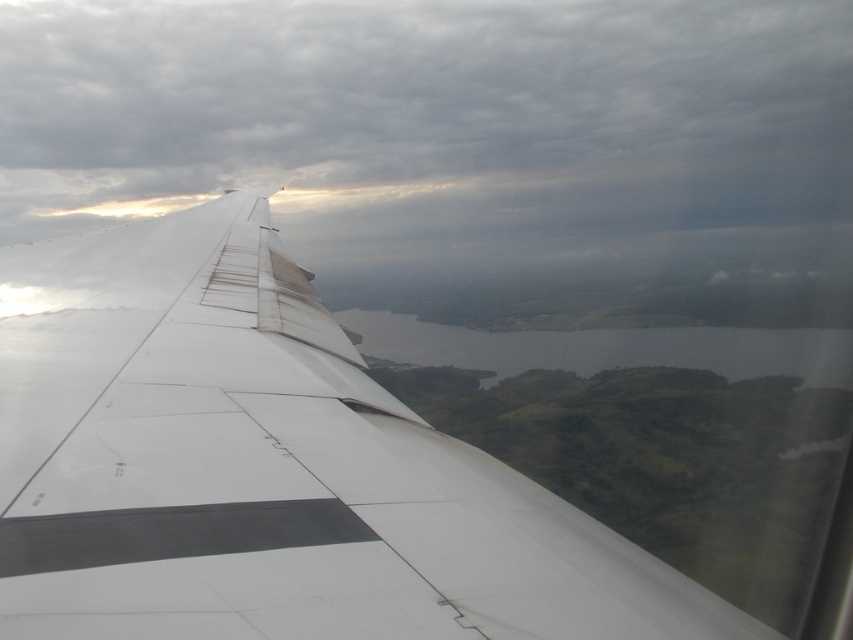
Is cloudy gray sky at upper center wider than white matte wing at upper left?

Indeed, cloudy gray sky at upper center has a greater width compared to white matte wing at upper left.

Is point (67, 147) in front of point (184, 538)?

No, (67, 147) is behind (184, 538).

Between point (685, 19) and point (103, 451), which one is positioned behind?

Point (685, 19)

The width and height of the screenshot is (853, 640). Find the location of `cloudy gray sky at upper center`. cloudy gray sky at upper center is located at coordinates (437, 125).